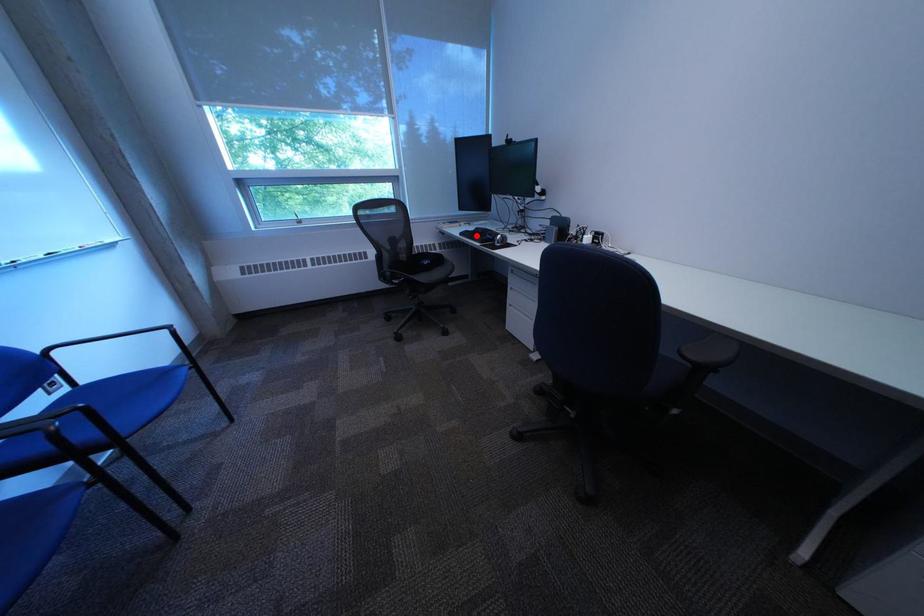
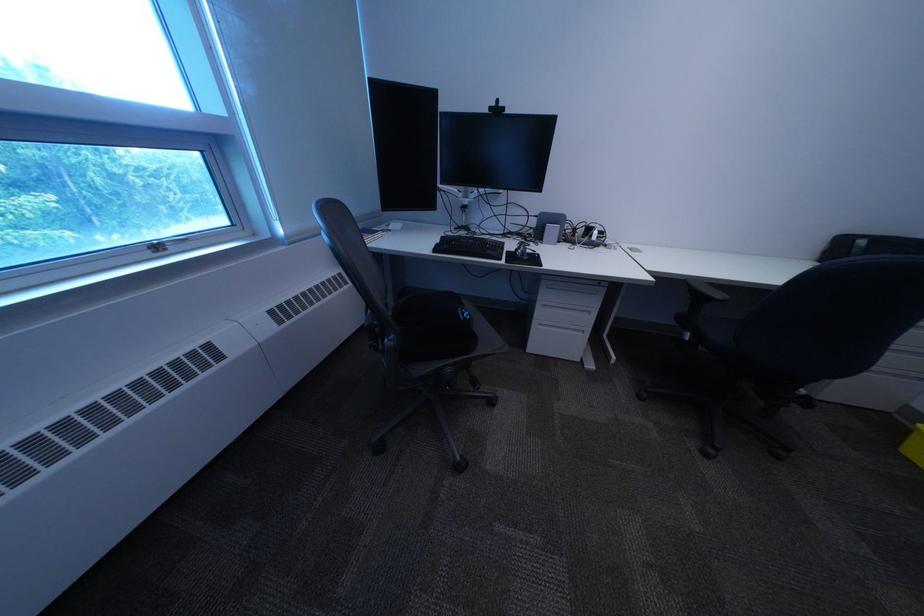
Question: I am providing you with two images of the same scene from different viewpoints. Given a red point in image1, look at the same physical point in image2. Is it:

Choices:
 (A) Closer to the viewpoint
 (B) Farther from the viewpoint

Answer: (B)